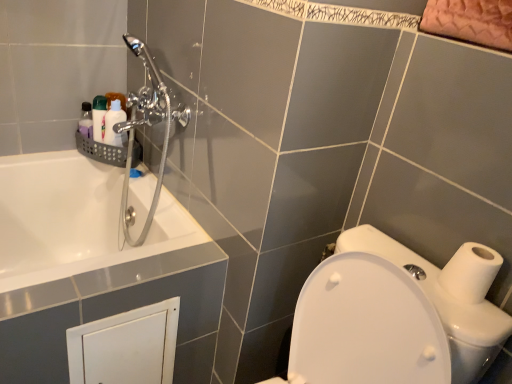
What do you see at coordinates (396, 315) in the screenshot? The height and width of the screenshot is (384, 512). I see `white glossy toilet at lower right` at bounding box center [396, 315].

At what (x,y) coordinates should I click in order to perform the action: click on white glossy toilet at lower right. Please return your answer as a coordinate pair (x, y). This screenshot has height=384, width=512. Looking at the image, I should click on (396, 315).

Find the location of a particular element. This screenshot has width=512, height=384. translucent plastic soap at upper left, the first toiletry positioned from the left is located at coordinates (99, 117).

Which of these two, white glossy bottle at upper left, which appears as the second toiletry when viewed from the left, or chrome metallic shower head at upper left, is bigger?

Bigger between the two is chrome metallic shower head at upper left.

At what (x,y) coordinates should I click in order to perform the action: click on the 1st toiletry counting from the left side of the chrome metallic shower head at upper left. Please return your answer as a coordinate pair (x, y). The image size is (512, 384). Looking at the image, I should click on (114, 124).

Would you say white glossy bottle at upper left, which appears as the second toiletry when viewed from the left, contains chrome metallic shower head at upper left?

No, chrome metallic shower head at upper left is not surrounded by white glossy bottle at upper left, which appears as the second toiletry when viewed from the left.

Is point (124, 119) closer or farther from the camera than point (113, 128)?

Point (124, 119).

What's the angular difference between translucent plastic soap at upper left, the first toiletry positioned from the left, and white glossy toilet at lower right's facing directions?

They differ by 78.8 degrees in their facing directions.

Which of these two, translucent plastic soap at upper left, the first toiletry positioned from the left, or white glossy toilet at lower right, is bigger?

Bigger between the two is white glossy toilet at lower right.

Does translucent plastic soap at upper left, the first toiletry positioned from the left, appear on the left side of white glossy toilet at lower right?

Yes, translucent plastic soap at upper left, the first toiletry positioned from the left, is to the left of white glossy toilet at lower right.

Measure the distance between translucent plastic soap at upper left, the second toiletry viewed from the right, and white glossy toilet at lower right.

translucent plastic soap at upper left, the second toiletry viewed from the right, and white glossy toilet at lower right are 3.46 feet apart from each other.

Does white matte toilet paper at right contain white glossy bottle at upper left, which ranks as the first toiletry in right-to-left order?

No.

Can you tell me how much white matte toilet paper at right and white glossy bottle at upper left, which ranks as the first toiletry in right-to-left order, differ in facing direction?

74.2 degrees.

Which object is more forward, white matte toilet paper at right or white glossy bottle at upper left, which appears as the second toiletry when viewed from the left?

white matte toilet paper at right is in front.

Is white matte toilet paper at right wider or thinner than white glossy bottle at upper left, which appears as the second toiletry when viewed from the left?

In the image, white matte toilet paper at right appears to be wider than white glossy bottle at upper left, which appears as the second toiletry when viewed from the left.

Which toiletry is the 2nd one when counting from the left side of the white matte toilet paper at right? Please provide its 2D coordinates.

[(99, 117)]

Between translucent plastic soap at upper left, the first toiletry positioned from the left, and white matte toilet paper at right, which one has larger size?

translucent plastic soap at upper left, the first toiletry positioned from the left, is bigger.

Is translucent plastic soap at upper left, the second toiletry viewed from the right, oriented towards white matte toilet paper at right?

No, translucent plastic soap at upper left, the second toiletry viewed from the right, is not aimed at white matte toilet paper at right.

Is translucent plastic soap at upper left, the first toiletry positioned from the left, wider than white matte toilet paper at right?

Incorrect, the width of translucent plastic soap at upper left, the first toiletry positioned from the left, does not surpass that of white matte toilet paper at right.

Between white glossy toilet at lower right and translucent plastic soap at upper left, the first toiletry positioned from the left, which one is positioned in front?

white glossy toilet at lower right is more forward.

Between white glossy toilet at lower right and translucent plastic soap at upper left, the first toiletry positioned from the left, which one appears on the right side from the viewer's perspective?

white glossy toilet at lower right.

Is there a large distance between white glossy toilet at lower right and translucent plastic soap at upper left, the first toiletry positioned from the left?

Yes, white glossy toilet at lower right and translucent plastic soap at upper left, the first toiletry positioned from the left, are located far from each other.

From a real-world perspective, which is physically below, white matte toilet paper at right or white glossy toilet at lower right?

white glossy toilet at lower right is physically lower.

Does white matte toilet paper at right have a lesser width compared to white glossy toilet at lower right?

Yes, white matte toilet paper at right is thinner than white glossy toilet at lower right.

Considering the points (442, 275) and (445, 280), which point is in front, point (442, 275) or point (445, 280)?

The point (445, 280) is closer.

Considering the relative positions of white matte toilet paper at right and white glossy toilet at lower right in the image provided, is white matte toilet paper at right to the right of white glossy toilet at lower right from the viewer's perspective?

Indeed, white matte toilet paper at right is positioned on the right side of white glossy toilet at lower right.

At what (x,y) coordinates should I click in order to perform the action: click on toilet paper to the right of white glossy toilet at lower right. Please return your answer as a coordinate pair (x, y). Looking at the image, I should click on (470, 272).

From the image's perspective, is white glossy toilet at lower right located above or below white matte toilet paper at right?

white glossy toilet at lower right is situated lower than white matte toilet paper at right in the image.

Is point (459, 352) closer to camera compared to point (480, 273)?

Yes, point (459, 352) is in front of point (480, 273).

Which is more to the right, white glossy toilet at lower right or white matte toilet paper at right?

white matte toilet paper at right.

Starting from the chrome metallic shower head at upper left, which toiletry is the 1st one to the left? Please provide its 2D coordinates.

[(114, 124)]

Identify the location of toilet below the translucent plastic soap at upper left, the first toiletry positioned from the left (from a real-world perspective). (396, 315).

Based on their spatial positions, is chrome metallic shower head at upper left or white matte toilet paper at right closer to white glossy toilet at lower right?

white matte toilet paper at right.

Based on their spatial positions, is chrome metallic shower head at upper left or white glossy toilet at lower right closer to translucent plastic soap at upper left, the second toiletry viewed from the right?

The object closer to translucent plastic soap at upper left, the second toiletry viewed from the right, is chrome metallic shower head at upper left.

Considering their positions, is white glossy toilet at lower right positioned further to white glossy bottle at upper left, which appears as the second toiletry when viewed from the left, than white matte toilet paper at right?

white matte toilet paper at right is positioned further to the anchor white glossy bottle at upper left, which appears as the second toiletry when viewed from the left.

Considering their positions, is translucent plastic soap at upper left, the first toiletry positioned from the left, positioned closer to chrome metallic shower head at upper left than white glossy toilet at lower right?

Based on the image, translucent plastic soap at upper left, the first toiletry positioned from the left, appears to be nearer to chrome metallic shower head at upper left.

Based on their spatial positions, is chrome metallic shower head at upper left or translucent plastic soap at upper left, the first toiletry positioned from the left, closer to white glossy toilet at lower right?

The object closer to white glossy toilet at lower right is chrome metallic shower head at upper left.

From the image, which object appears to be farther from translucent plastic soap at upper left, the second toiletry viewed from the right, white glossy bottle at upper left, which ranks as the first toiletry in right-to-left order, or white matte toilet paper at right?

white matte toilet paper at right lies further to translucent plastic soap at upper left, the second toiletry viewed from the right, than the other object.

From the image, which object appears to be farther from translucent plastic soap at upper left, the second toiletry viewed from the right, white glossy bottle at upper left, which appears as the second toiletry when viewed from the left, or chrome metallic shower head at upper left?

chrome metallic shower head at upper left lies further to translucent plastic soap at upper left, the second toiletry viewed from the right, than the other object.

When comparing their distances from translucent plastic soap at upper left, the second toiletry viewed from the right, does white glossy toilet at lower right or chrome metallic shower head at upper left seem further?

The object further to translucent plastic soap at upper left, the second toiletry viewed from the right, is white glossy toilet at lower right.

This screenshot has width=512, height=384. I want to click on shower between white glossy bottle at upper left, which appears as the second toiletry when viewed from the left, and white matte toilet paper at right from left to right, so click(148, 125).

Where is `toiletry between translucent plastic soap at upper left, the second toiletry viewed from the right, and white matte toilet paper at right`? The width and height of the screenshot is (512, 384). toiletry between translucent plastic soap at upper left, the second toiletry viewed from the right, and white matte toilet paper at right is located at coordinates (114, 124).

What are the coordinates of `toilet between chrome metallic shower head at upper left and white matte toilet paper at right from left to right` in the screenshot? It's located at (396, 315).

The height and width of the screenshot is (384, 512). I want to click on toiletry between white glossy toilet at lower right and translucent plastic soap at upper left, the first toiletry positioned from the left, along the z-axis, so click(x=114, y=124).